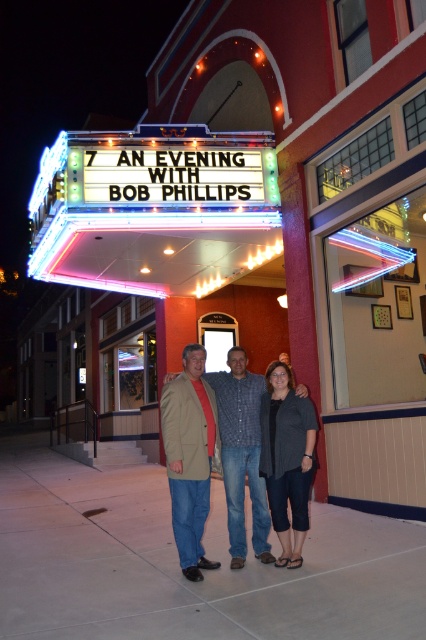
Based on the photo, you are standing at the point labeled as point (155,209). What object is located exactly at that point?

The neontexturedmarquee sign at upper center is located exactly at point (155,209).

You are standing on the sidewalk in front of the theater and want to take a photo of the dark gray textured blazer at center and the neontexturedmarquee sign at upper center. Which object should you focus on first if you want to capture both in the frame without moving the camera?

You should focus on the dark gray textured blazer at center first because the neontexturedmarquee sign at upper center is to the left of it, so by centering the blazer, the marquee will naturally be in the frame to its left.